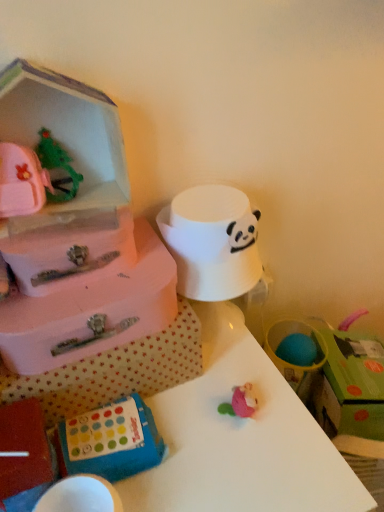
Question: From the image's perspective, would you say white glossy table at center is positioned over green cardboard box at upper right?

Choices:
 (A) yes
 (B) no

Answer: (B)

Question: Does white glossy table at center lie behind green cardboard box at upper right?

Choices:
 (A) no
 (B) yes

Answer: (A)

Question: Is white glossy table at center aimed at green cardboard box at upper right?

Choices:
 (A) no
 (B) yes

Answer: (A)

Question: Is white glossy table at center completely or partially outside of green cardboard box at upper right?

Choices:
 (A) yes
 (B) no

Answer: (A)

Question: From the image's perspective, is white glossy table at center located beneath green cardboard box at upper right?

Choices:
 (A) no
 (B) yes

Answer: (B)

Question: From a real-world perspective, does white glossy table at center sit lower than green cardboard box at upper right?

Choices:
 (A) no
 (B) yes

Answer: (B)

Question: Is white glossy table at center inside green cardboard box at upper right?

Choices:
 (A) yes
 (B) no

Answer: (B)

Question: Is green cardboard box at upper right further to camera compared to white glossy table at center?

Choices:
 (A) no
 (B) yes

Answer: (B)

Question: Would you say green cardboard box at upper right is outside white glossy table at center?

Choices:
 (A) yes
 (B) no

Answer: (A)

Question: From the image's perspective, is green cardboard box at upper right on top of white glossy table at center?

Choices:
 (A) no
 (B) yes

Answer: (B)

Question: Can you confirm if green cardboard box at upper right is shorter than white glossy table at center?

Choices:
 (A) yes
 (B) no

Answer: (A)

Question: Can you confirm if green cardboard box at upper right is positioned to the right of white glossy table at center?

Choices:
 (A) yes
 (B) no

Answer: (A)

Question: Is white glossy table at center positioned in front of blue rubbery toy at lower center?

Choices:
 (A) no
 (B) yes

Answer: (B)